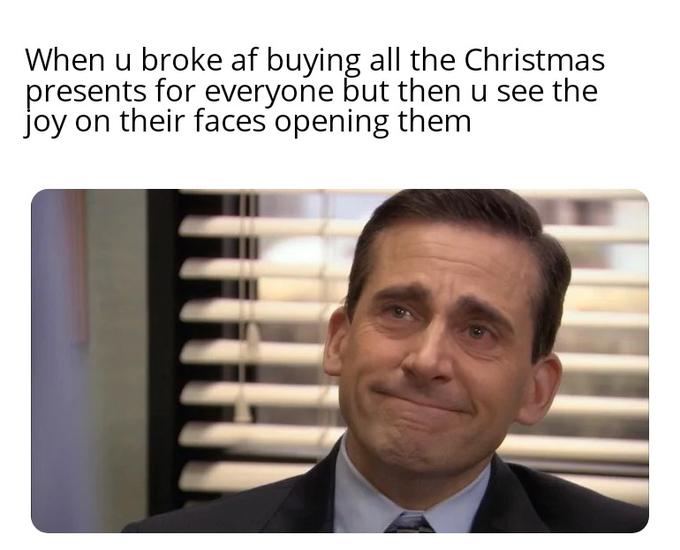
I want to click on blinds, so click(241, 478), click(239, 445), click(245, 392), click(267, 360), click(272, 317), click(288, 260), click(300, 236).